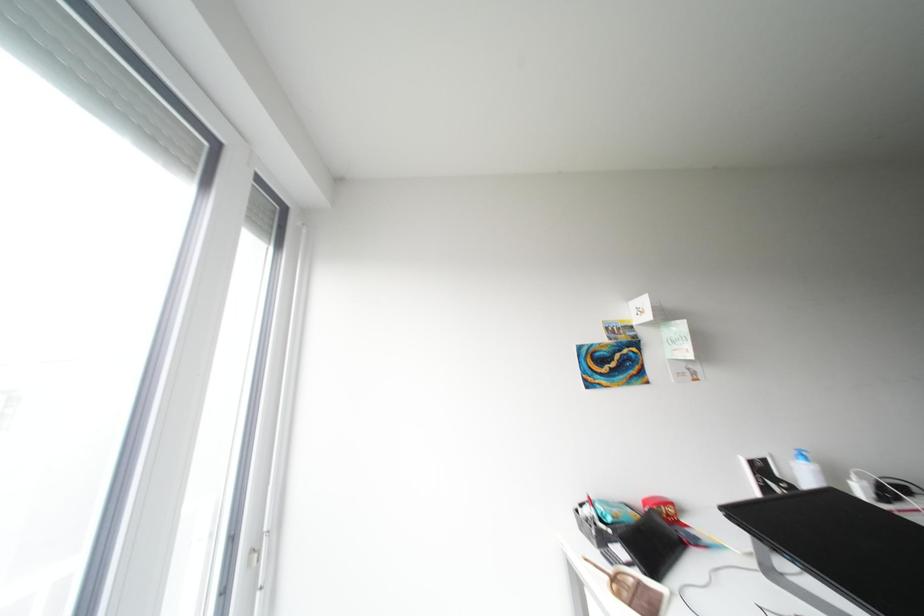
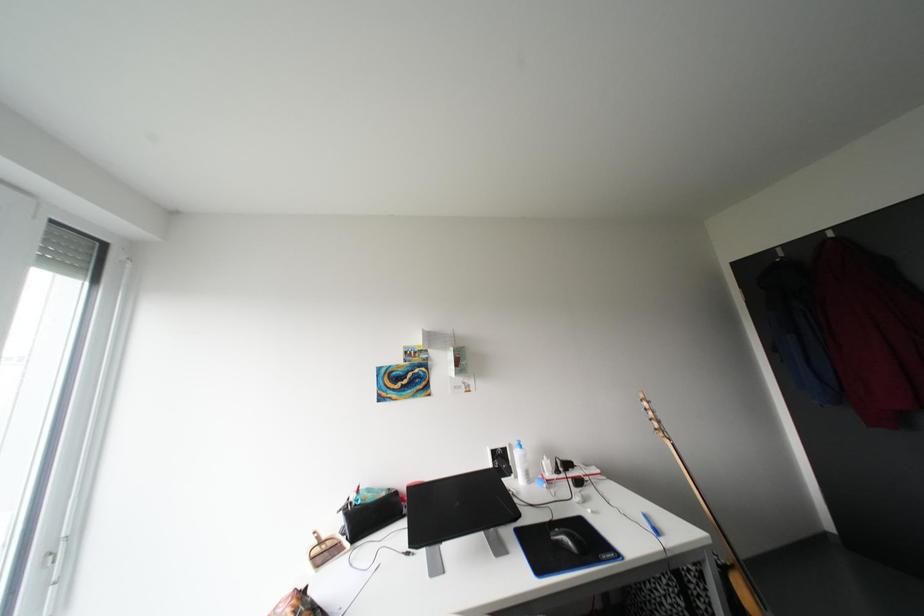
Question: The first image is from the beginning of the video and the second image is from the end. How did the camera likely rotate when shooting the video?

Choices:
 (A) Left
 (B) Right
 (C) Up
 (D) Down

Answer: (B)